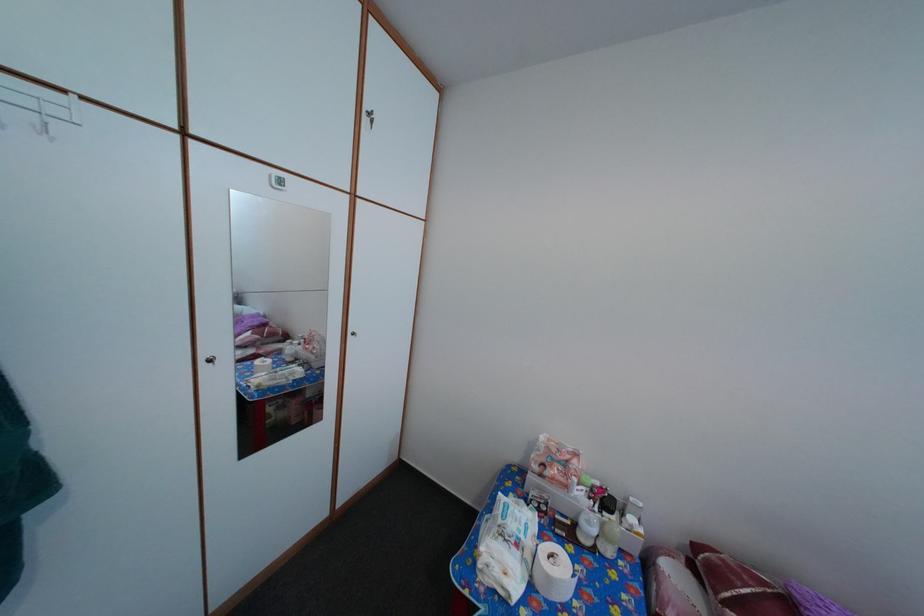
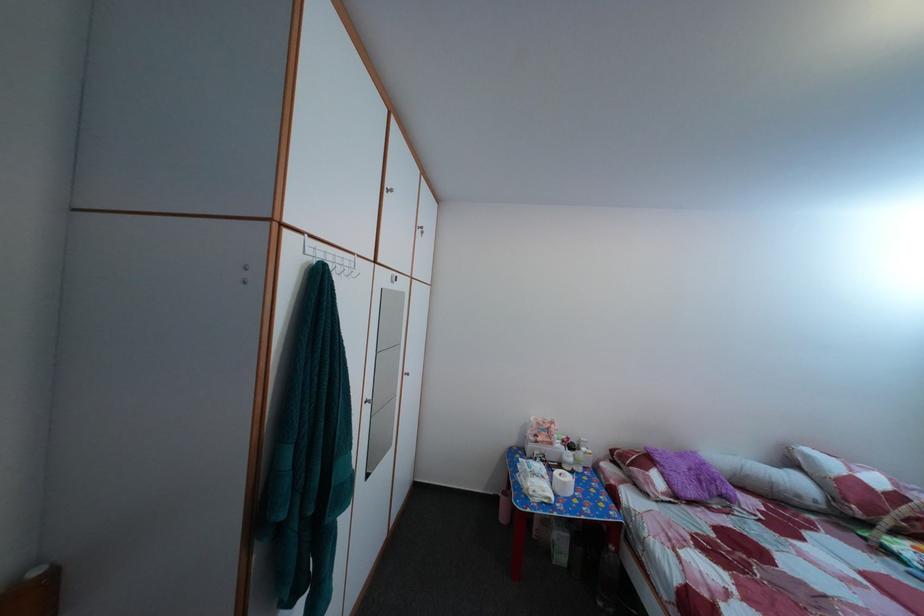
In the second image, find the point that corresponds to (613,498) in the first image.

(578, 447)